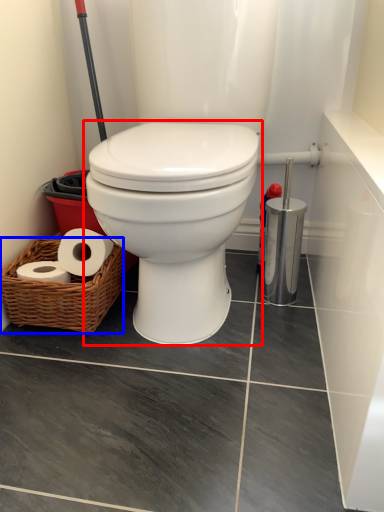
Question: Which of the following is the farthest to the observer, toilet (highlighted by a red box) or basket (highlighted by a blue box)?

Choices:
 (A) toilet
 (B) basket

Answer: (B)